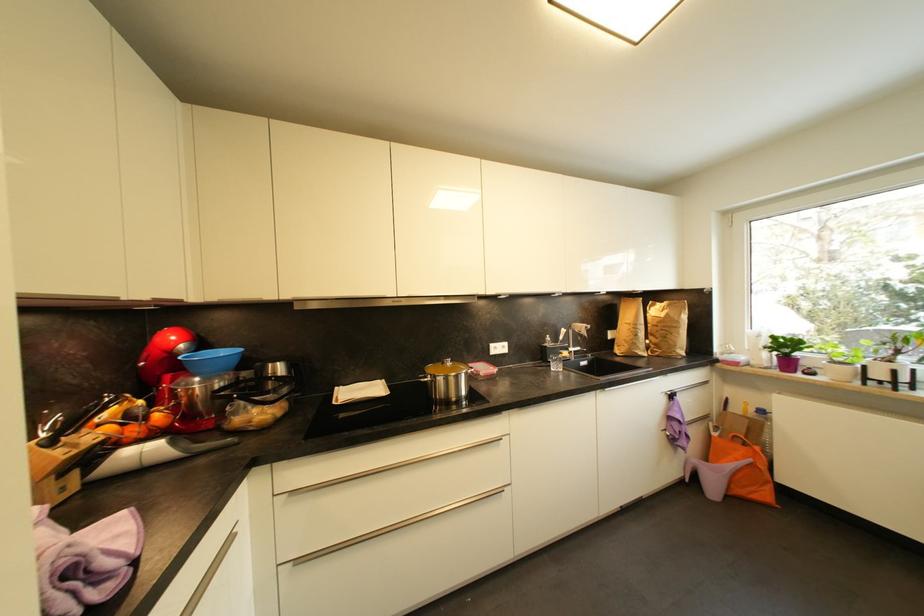
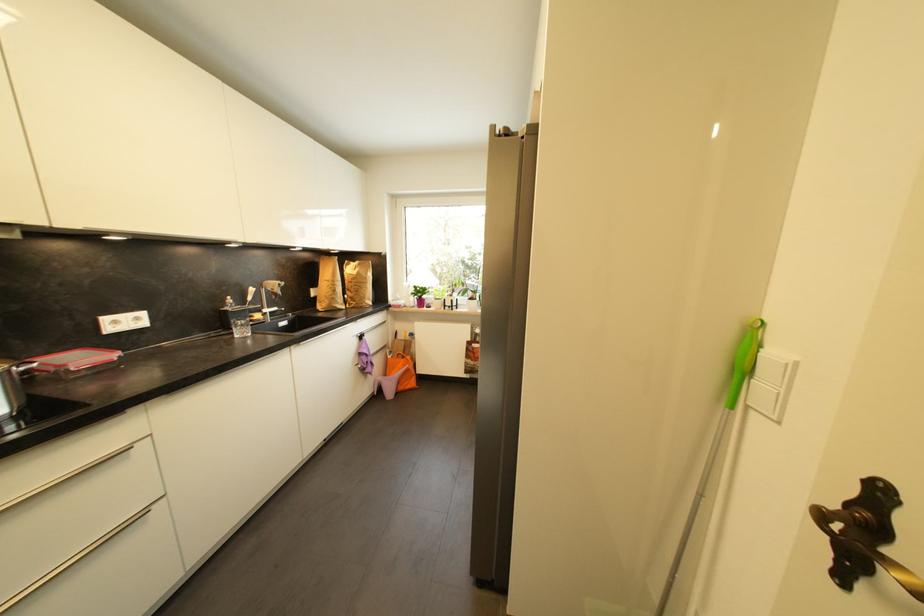
In the second image, find the point that corresponds to (x=720, y=436) in the first image.

(395, 359)